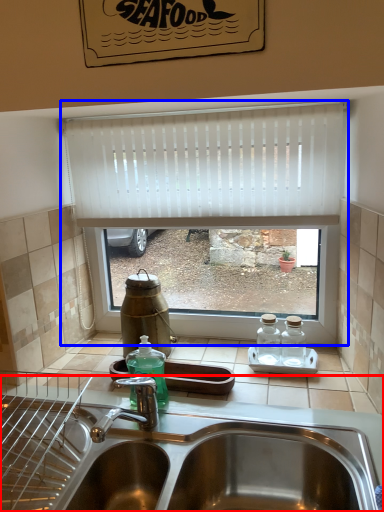
Question: Which object is closer to the camera taking this photo, sink (highlighted by a red box) or window (highlighted by a blue box)?

Choices:
 (A) sink
 (B) window

Answer: (A)